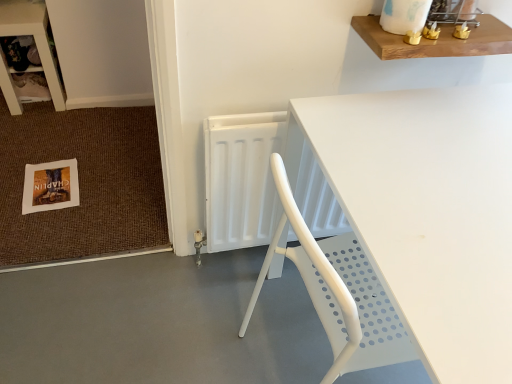
Question: Can you confirm if gray smooth concrete at lower left is shorter than wooden shelf at upper right?

Choices:
 (A) yes
 (B) no

Answer: (B)

Question: Does gray smooth concrete at lower left have a greater width compared to wooden shelf at upper right?

Choices:
 (A) yes
 (B) no

Answer: (A)

Question: Is gray smooth concrete at lower left positioned far away from wooden shelf at upper right?

Choices:
 (A) yes
 (B) no

Answer: (A)

Question: Is gray smooth concrete at lower left aimed at wooden shelf at upper right?

Choices:
 (A) no
 (B) yes

Answer: (A)

Question: Does gray smooth concrete at lower left appear on the right side of wooden shelf at upper right?

Choices:
 (A) yes
 (B) no

Answer: (B)

Question: Is gray smooth concrete at lower left to the left of wooden shelf at upper right from the viewer's perspective?

Choices:
 (A) yes
 (B) no

Answer: (A)

Question: Is wooden shelf at upper left to the left of white plastic radiator at center from the viewer's perspective?

Choices:
 (A) yes
 (B) no

Answer: (A)

Question: Considering the relative sizes of wooden shelf at upper left and white plastic radiator at center in the image provided, is wooden shelf at upper left thinner than white plastic radiator at center?

Choices:
 (A) yes
 (B) no

Answer: (B)

Question: Is wooden shelf at upper left far from white plastic radiator at center?

Choices:
 (A) no
 (B) yes

Answer: (B)

Question: Is wooden shelf at upper left further to camera compared to white plastic radiator at center?

Choices:
 (A) no
 (B) yes

Answer: (B)

Question: Is wooden shelf at upper left placed right next to white plastic radiator at center?

Choices:
 (A) yes
 (B) no

Answer: (B)

Question: Considering the relative sizes of wooden shelf at upper left and white plastic radiator at center in the image provided, is wooden shelf at upper left wider than white plastic radiator at center?

Choices:
 (A) no
 (B) yes

Answer: (B)

Question: Is wooden shelf at upper right at the right side of white paper postcard at lower left?

Choices:
 (A) no
 (B) yes

Answer: (B)